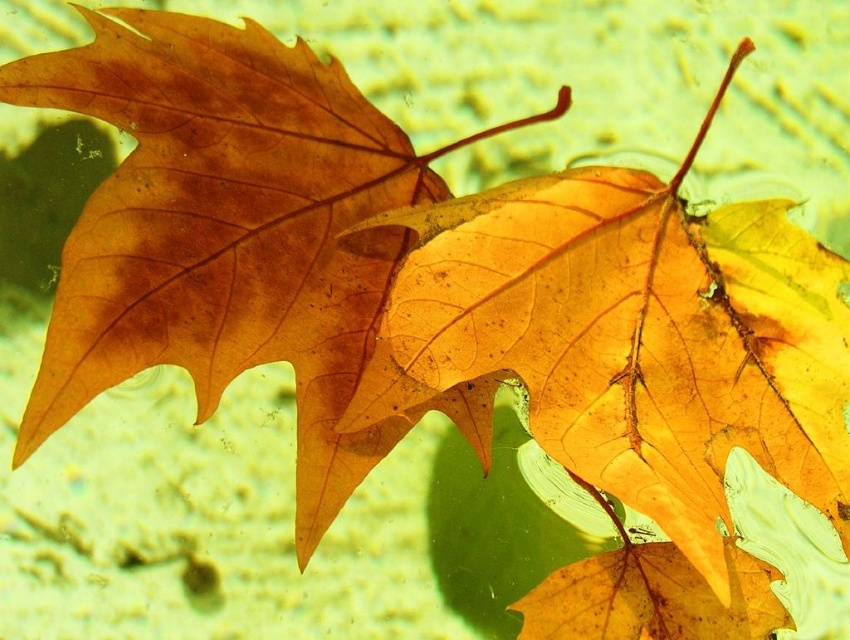
Who is shorter, shiny orange leaf at center or matte orange leaf at center?

Standing shorter between the two is matte orange leaf at center.

Is shiny orange leaf at center closer to the viewer compared to matte orange leaf at center?

Yes, it is.

Is point (570, 396) positioned in front of point (214, 401)?

Yes, it is.

I want to click on shiny orange leaf at center, so click(638, 378).